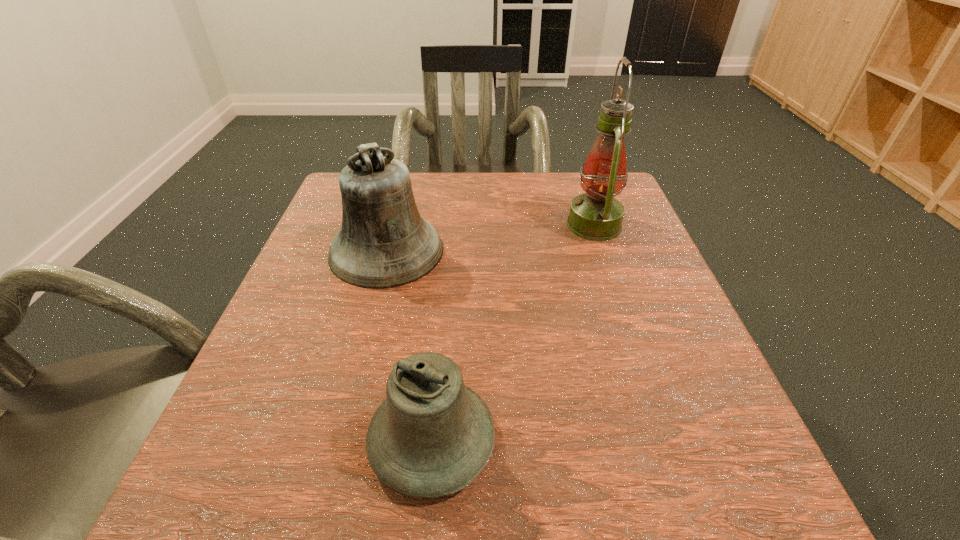
Identify the location of empty location between the taller bell and the oil lamp. The height and width of the screenshot is (540, 960). (491, 238).

The image size is (960, 540). Find the location of `empty space that is in between the shorter bell and the rightmost object`. empty space that is in between the shorter bell and the rightmost object is located at coordinates (513, 333).

At what (x,y) coordinates should I click in order to perform the action: click on the second closest object to the second shortest object. Please return your answer as a coordinate pair (x, y). Looking at the image, I should click on (596, 215).

Identify which object is the closest to the oil lamp. Please provide its 2D coordinates. Your answer should be formatted as a tuple, i.e. [(x, y)], where the tuple contains the x and y coordinates of a point satisfying the conditions above.

[(383, 243)]

Image resolution: width=960 pixels, height=540 pixels. In order to click on vacant space that satisfies the following two spatial constraints: 1. on the back side of the second shortest object; 2. on the left side of the tallest object in this screenshot , I will do `click(394, 225)`.

The image size is (960, 540). Find the location of `free spot that satisfies the following two spatial constraints: 1. on the back side of the farther bell; 2. on the right side of the rightmost object`. free spot that satisfies the following two spatial constraints: 1. on the back side of the farther bell; 2. on the right side of the rightmost object is located at coordinates (394, 225).

Locate an element on the screen. The image size is (960, 540). vacant space that satisfies the following two spatial constraints: 1. on the front side of the nearest object; 2. on the right side of the second shortest object is located at coordinates (337, 440).